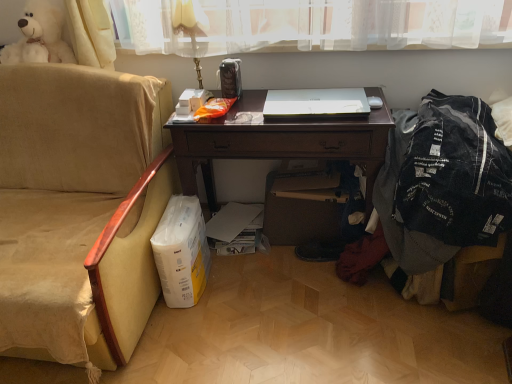
Find the location of a particular element. This screenshot has width=512, height=384. vacant area that lies in front of brown cardboard box at lower center is located at coordinates (294, 285).